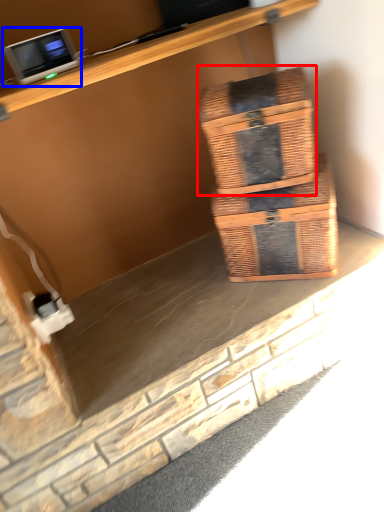
Question: Which object is closer to the camera taking this photo, box (highlighted by a red box) or desktop computer (highlighted by a blue box)?

Choices:
 (A) box
 (B) desktop computer

Answer: (B)